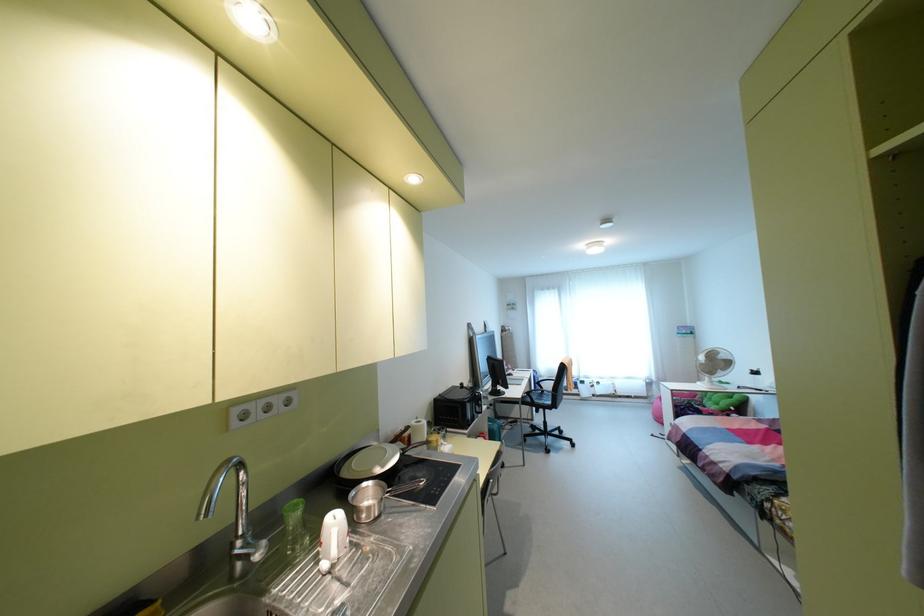
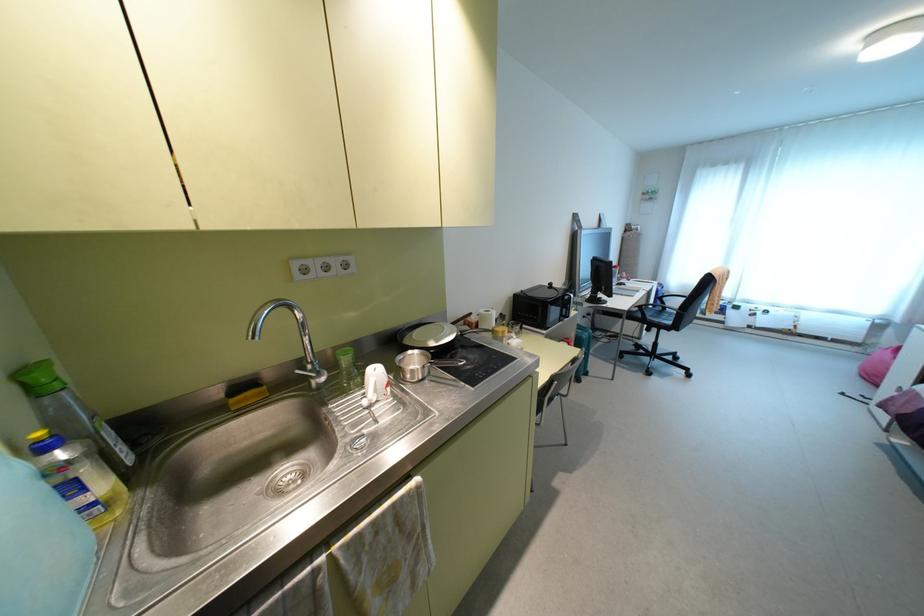
The point at (483,407) is marked in the first image. Where is the corresponding point in the second image?

(573, 313)